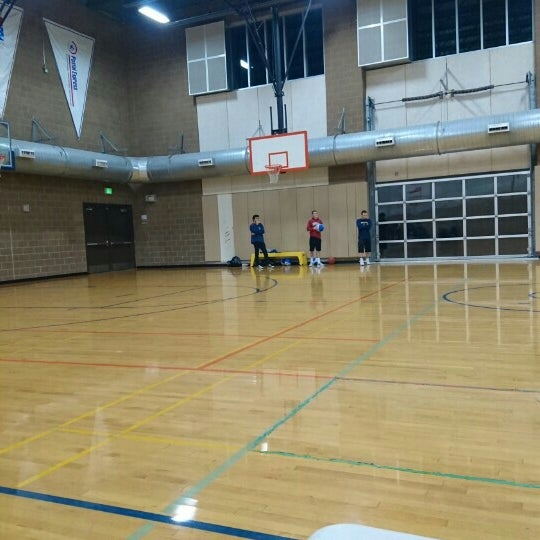
This screenshot has height=540, width=540. I want to click on doors, so click(x=106, y=237), click(x=122, y=235).